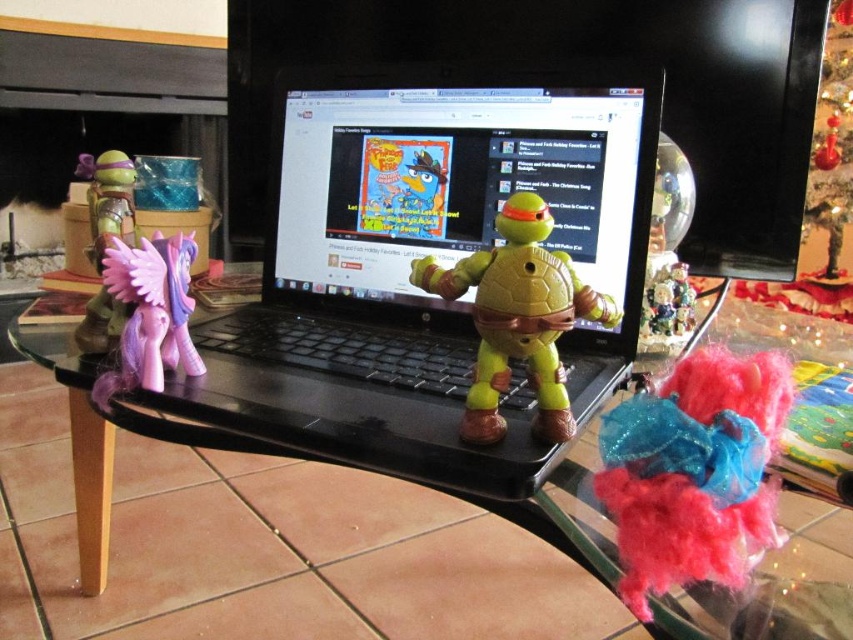
Question: Which point appears closest to the camera in this image?

Choices:
 (A) (763, 148)
 (B) (618, 540)

Answer: (B)

Question: Does black plastic laptop at center have a lesser width compared to shiny black laptop at center?

Choices:
 (A) no
 (B) yes

Answer: (B)

Question: Which point is farther to the camera?

Choices:
 (A) shiny black laptop at center
 (B) matte purple plastic pony at left
 (C) green plastic turtle at center
 (D) black plastic laptop at center

Answer: (A)

Question: Which object is the farthest from the black plastic laptop at center?

Choices:
 (A) shiny plastic laptop at center
 (B) fuzzy fabric toy at lower right
 (C) green plastic turtle at center

Answer: (B)

Question: Does transparent glass table at center have a larger size compared to shiny plastic laptop at center?

Choices:
 (A) yes
 (B) no

Answer: (A)

Question: Is the position of black plastic laptop at center less distant than that of matte plastic turtle at upper left?

Choices:
 (A) no
 (B) yes

Answer: (B)